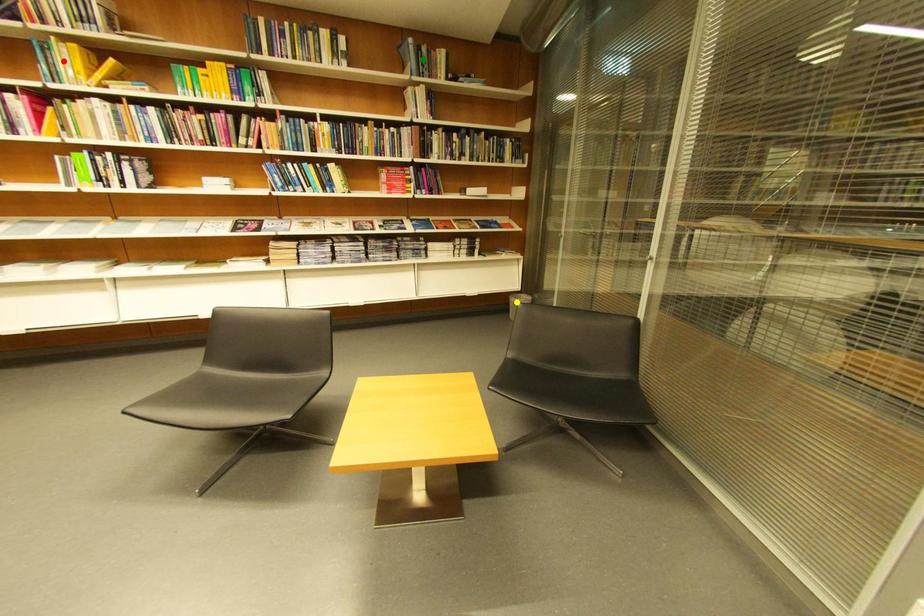
Order these from farthest to nearest:
yellow point | green point | red point

1. yellow point
2. green point
3. red point